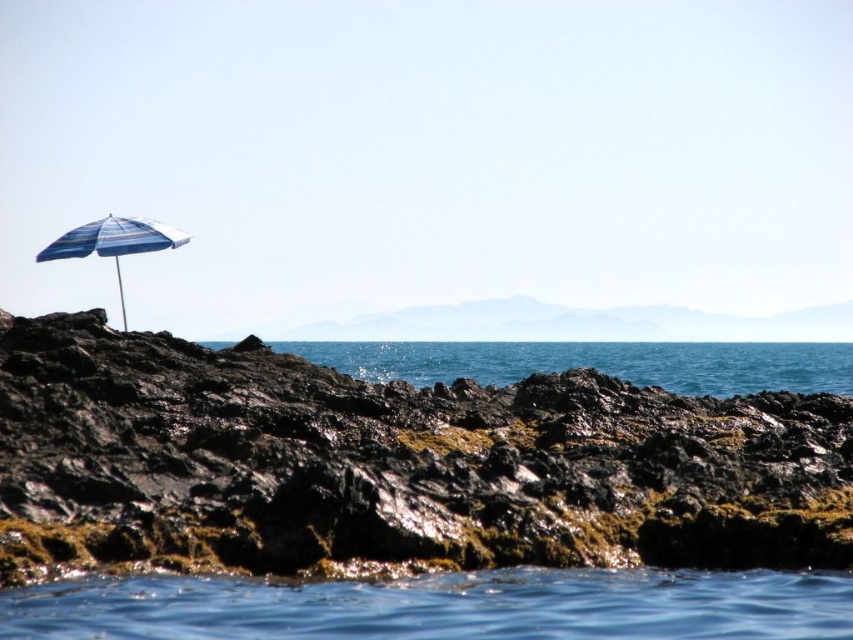
Describe the element at coordinates (392, 465) in the screenshot. I see `black rock at left` at that location.

Between point (560, 500) and point (84, 252), which one is positioned in front?

Point (560, 500)

The width and height of the screenshot is (853, 640). What do you see at coordinates (392, 465) in the screenshot? I see `black rock at left` at bounding box center [392, 465].

Image resolution: width=853 pixels, height=640 pixels. What are the coordinates of `black rock at left` in the screenshot? It's located at (392, 465).

Between blue water at center and striped fabric umbrella at left, which one has less height?

Standing shorter between the two is blue water at center.

Is blue water at center smaller than striped fabric umbrella at left?

Actually, blue water at center might be larger than striped fabric umbrella at left.

You are a GUI agent. You are given a task and a screenshot of the screen. Output one action in this format:
    pyautogui.click(x=<x>, y=<y>)
    Task: Click on the blue water at center
    
    Given the screenshot: What is the action you would take?
    pyautogui.click(x=596, y=362)

Describe the element at coordinates (392, 465) in the screenshot. This screenshot has width=853, height=640. I see `black rock at left` at that location.

Does point (525, 422) come in front of point (798, 348)?

Yes.

Identify the location of black rock at left. (392, 465).